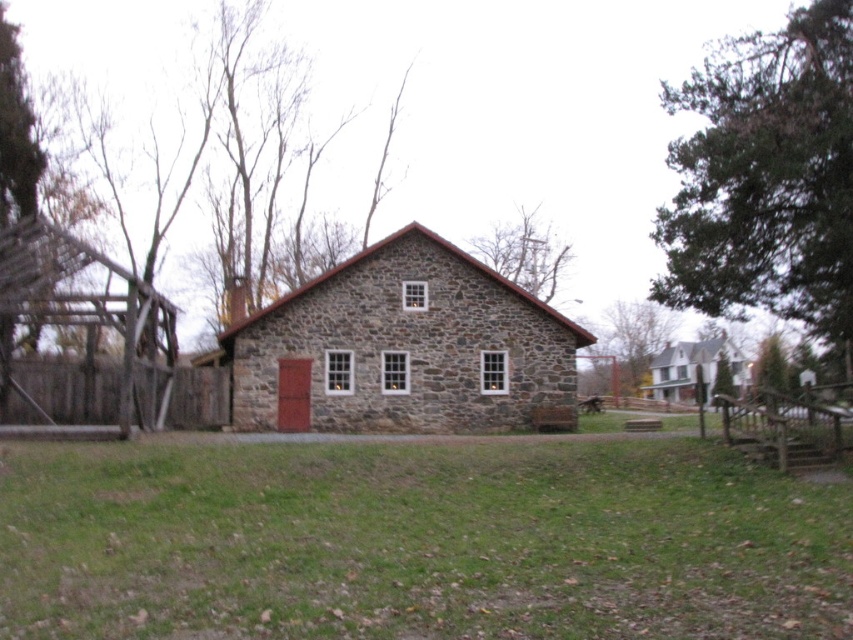
You are standing in front of the stone building and want to take a photo of the green grass at center and the white stone barn at center. Which object should you focus on first if you want to capture both in a single frame without moving the camera?

You should focus on the white stone barn at center first because it is taller than the green grass at center, allowing both to be in the frame more effectively.

Looking at this image, you are standing in front of the stone building and want to walk to the green grass at center. Is there a clear path to walk there without going through the stone barn at center?

The green grass at center is positioned under stone barn at center, so the stone barn is directly above the grass. This means there is no obstruction blocking the path to the grass, so you can walk there without going through the barn.

You are standing at the point marked by the coordinates point (418, 541) in front of the stone building with a red roof. What is the color of the ground under your feet?

The point (418, 541) marks green grass at center, so the ground under your feet is green grass.